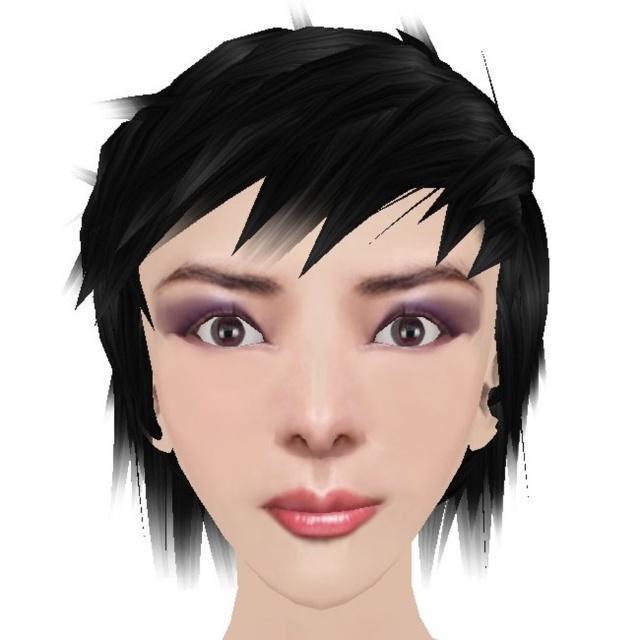
In the scene shown: You are holding a 12 inch ruler and want to measure the distance from your eyes to the point at coordinates point (356, 301) in the image. Can your ruler reach that point?

The point at coordinates point (356, 301) is 12.95 inches away from the viewer. Since your ruler is 12 inches long, it cannot reach the point as it is slightly farther than the ruler length.

You are an artist trying to replicate this portrait. You need to place the purple matte eye at center accurately. What are the coordinates where you should position it?

The purple matte eye at center should be placed at coordinates point [417,324].

You are a makeup artist analyzing the portrait. The point at coordinates (220, 326) is marked. Which specific feature does this point correspond to in the portrait?

The point at coordinates (220, 326) corresponds to the purple glossy eye at center.